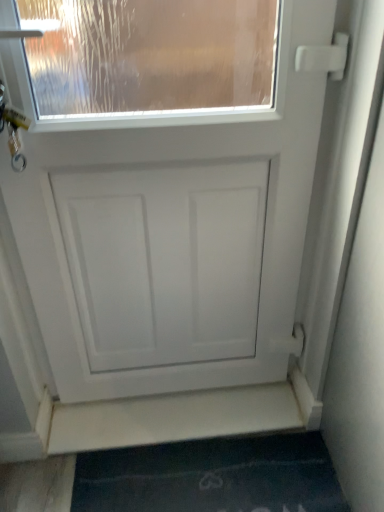
Locate an element on the screen. empty space that is ontop of white matte stairwell at lower center (from a real-world perspective) is located at coordinates (189, 416).